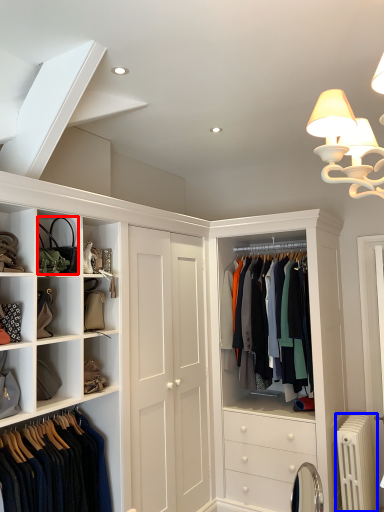
Question: Among these objects, which one is nearest to the camera, accessory (highlighted by a red box) or radiator (highlighted by a blue box)?

Choices:
 (A) accessory
 (B) radiator

Answer: (A)